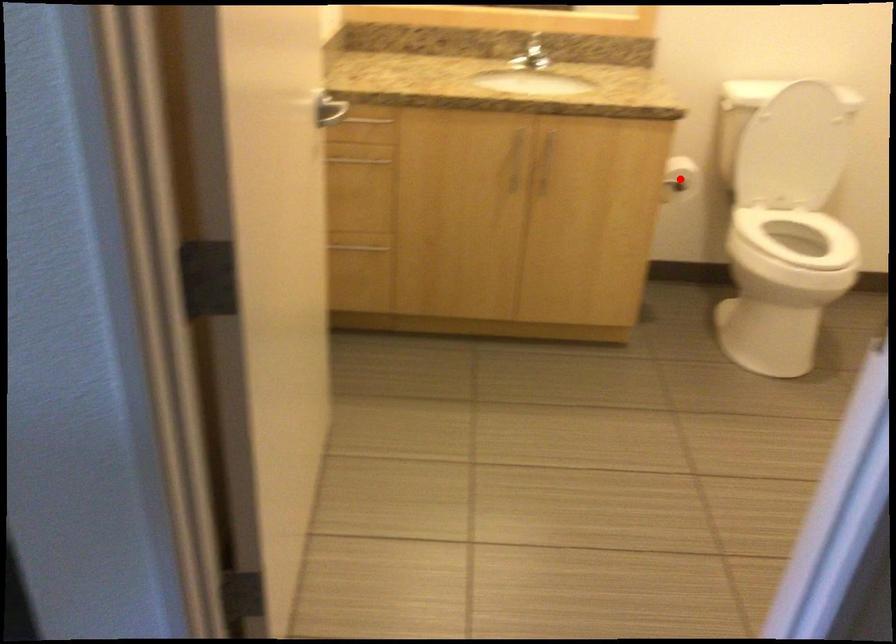
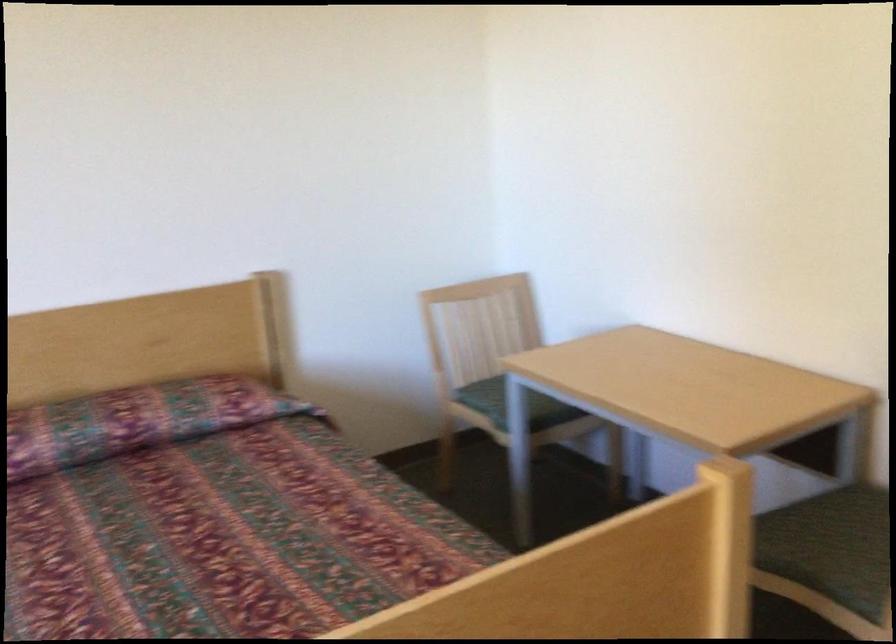
Question: I am providing you with two images of the same scene from different viewpoints. A red point is marked on the first image. Can you still see the location of the red point in image 2?

Choices:
 (A) Yes
 (B) No

Answer: (B)